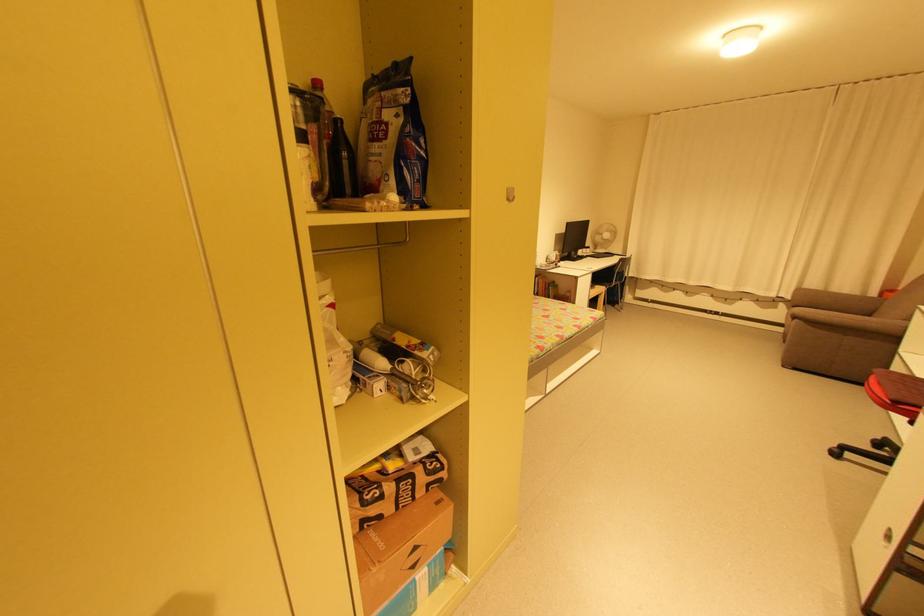
Where would you sitting on the brown sofa sitting surface? Please return your answer as a coordinate pair (x, y).

(848, 342)